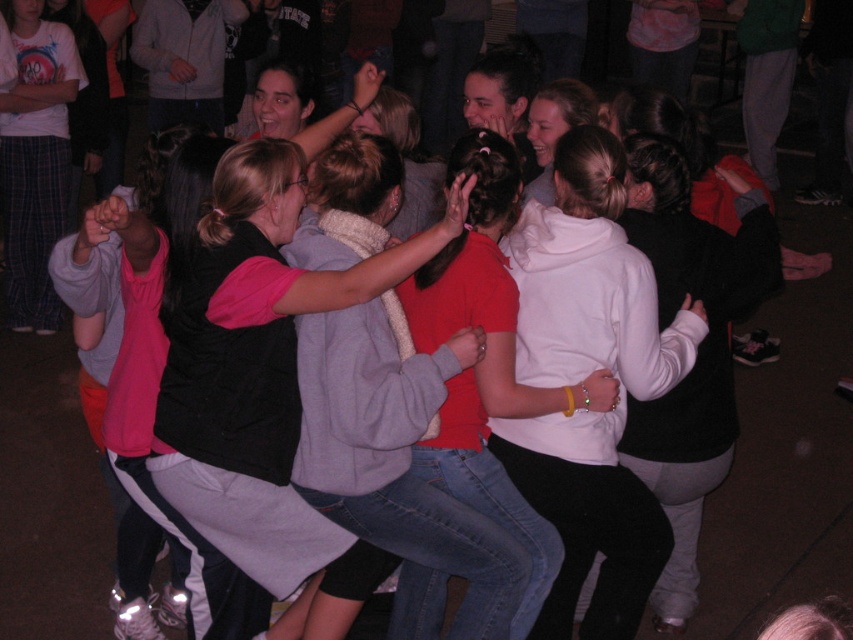
Based on the photo, you are standing in the center of the room where the group is dancing. There is a white fleece hoodie at center represented by point (583, 378). If you want to move towards the white fleece hoodie at center, which direction should you walk?

Since you are already at the center of the room and the white fleece hoodie at center is also at the center, you don not need to move in any specific direction. You are already facing the white fleece hoodie at center.

You are at a party and see two people in the center of the room wearing a white fleece hoodie at center and a matte black vest at center. Which one is positioned more to the right?

The white fleece hoodie at center is positioned to the right of the matte black vest at center, so the white fleece hoodie at center is more to the right.

You are organizing a photo shoot and need to arrange the white fleece hoodie at center and the matte black vest at center in a way that maximizes the visibility of both items. Given their sizes, which item should be placed closer to the camera to ensure both are clearly visible?

The white fleece hoodie at center occupies less space than the matte black vest at center, so placing the white fleece hoodie at center closer to the camera will help maintain visibility for both items.